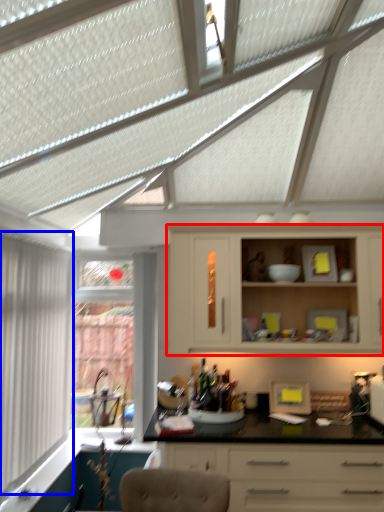
Question: Which of the following is the farthest to the observer, cabinetry (highlighted by a red box) or window (highlighted by a blue box)?

Choices:
 (A) cabinetry
 (B) window

Answer: (A)